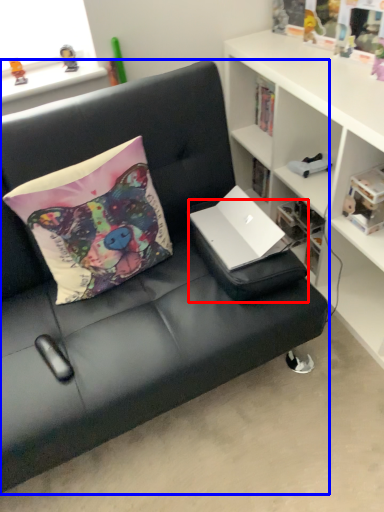
Question: Among these objects, which one is nearest to the camera, footrest (highlighted by a red box) or studio couch (highlighted by a blue box)?

Choices:
 (A) footrest
 (B) studio couch

Answer: (B)